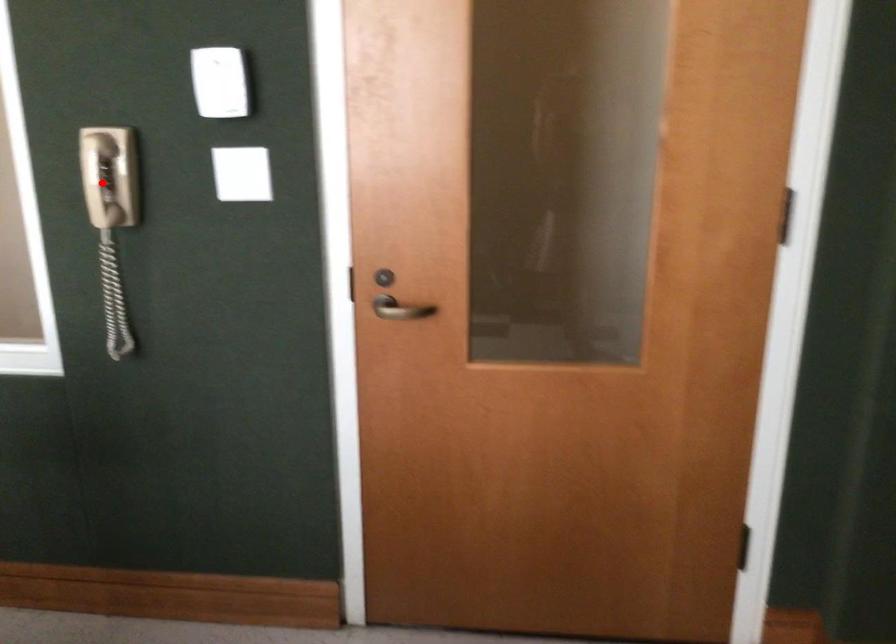
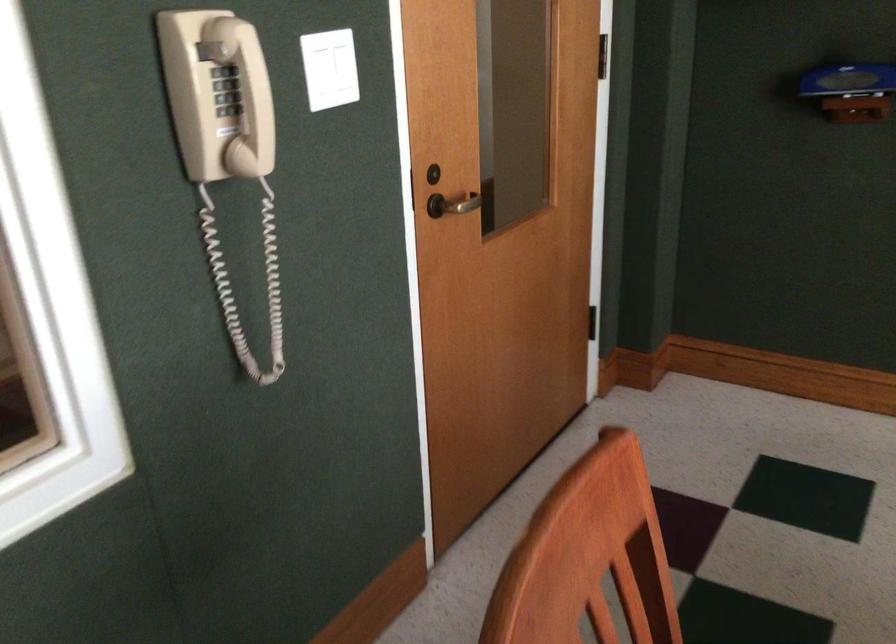
Question: A red point is marked in image1. In image2, is the corresponding 3D point closer to the camera or farther? Reply with the corresponding letter.

Choices:
 (A) The corresponding 3D point is closer.
 (B) The corresponding 3D point is farther.

Answer: (A)